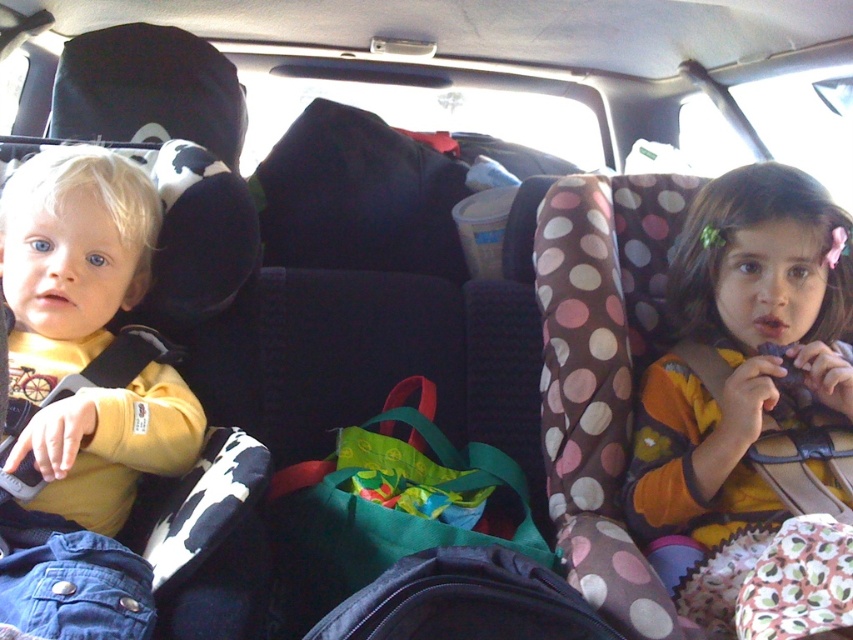
Is matte yellow shirt at left closer to the viewer compared to polka dot fabric car seat at right?

Yes, it is.

Is point (73, 528) more distant than point (726, 419)?

No, (73, 528) is closer to viewer.

Image resolution: width=853 pixels, height=640 pixels. Find the location of `matte yellow shirt at left`. matte yellow shirt at left is located at coordinates (80, 396).